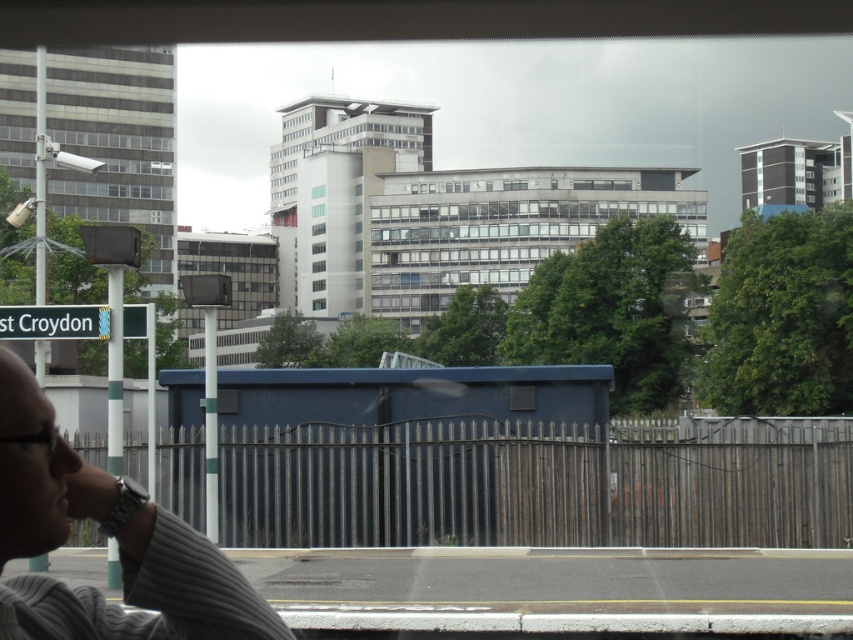
You are a passenger in a car and looking out the window. You see a blue metallic bus stop at center and a white plastic street sign at lower left. Which object is positioned lower in the scene?

The blue metallic bus stop at center is located below the white plastic street sign at lower left, so the bus stop is positioned lower.

You are a passenger seated in the vehicle and want to check the bus stop location relative to your current position. From your perspective inside the vehicle, is the blue metallic bus stop at center located to the left or right of the gray striped shirt at lower left?

The blue metallic bus stop at center is to the left of gray striped shirt at lower left, so from your perspective inside the vehicle, the bus stop is on the left side relative to the gray striped shirt at lower left.

You are inside a car and looking out the window. You see a point at coordinates (415, 456). What object is located at that point?

The point at coordinates (415, 456) corresponds to the blue metallic bus stop at center.